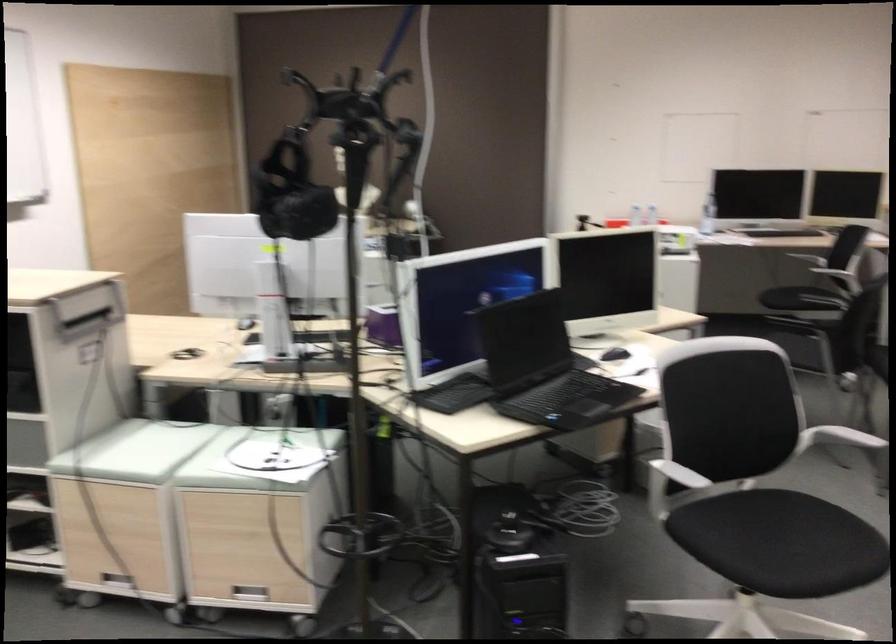
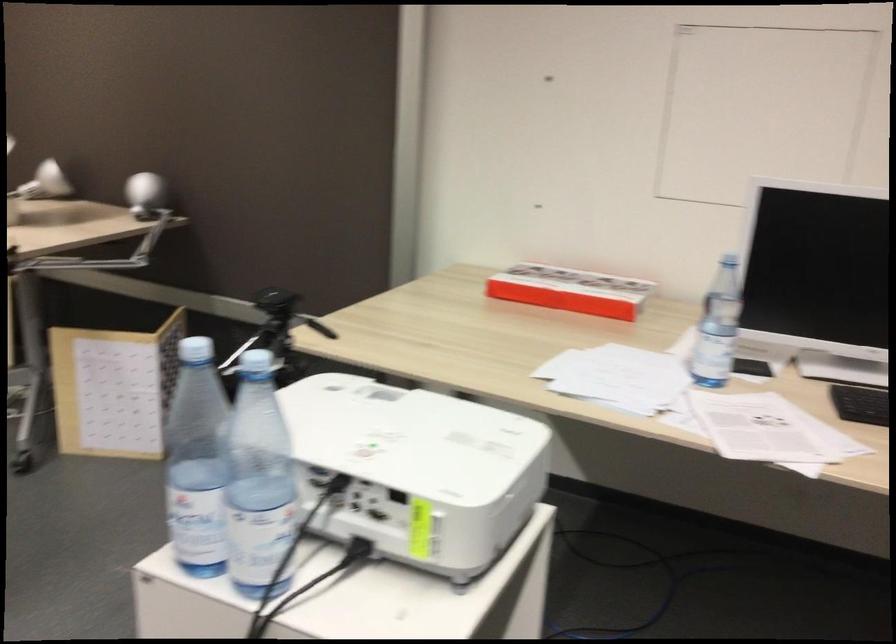
What movement of the cameraman would produce the second image?

The movement direction of the cameraman is right, forward.